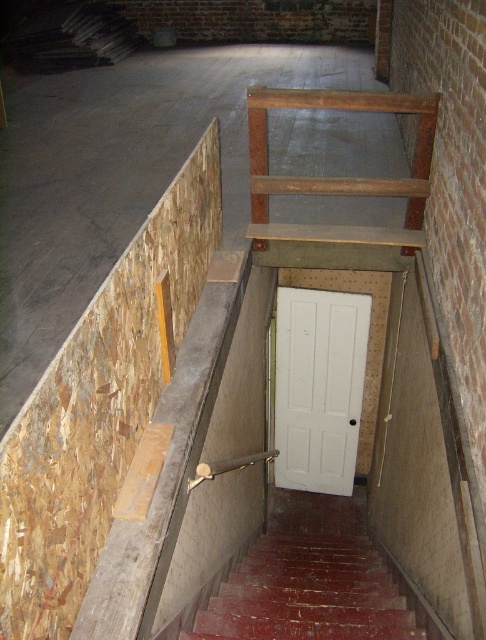
Is point (359, 589) positioned after point (250, 161)?

No, (359, 589) is in front of (250, 161).

Is rusty metal stairs at lower center behind wooden at upper center?

That is False.

Who is more forward, [275,621] or [252,180]?

Positioned in front is point [275,621].

You are a GUI agent. You are given a task and a screenshot of the screen. Output one action in this format:
    pyautogui.click(x=<x>, y=<y>)
    Task: Click on the rusty metal stairs at lower center
    Image resolution: width=486 pixels, height=640 pixels.
    Given the screenshot: What is the action you would take?
    pyautogui.click(x=308, y=593)

Does white painted wood door at center have a larger size compared to wooden at upper center?

Yes, white painted wood door at center is bigger than wooden at upper center.

Which is behind, point (367, 317) or point (302, 188)?

Positioned behind is point (367, 317).

The image size is (486, 640). I want to click on white painted wood door at center, so click(318, 387).

Does rusty metal stairs at lower center appear on the left side of white painted wood door at center?

Indeed, rusty metal stairs at lower center is positioned on the left side of white painted wood door at center.

Who is positioned more to the right, rusty metal stairs at lower center or white painted wood door at center?

white painted wood door at center

Which is behind, point (312, 548) or point (293, 413)?

Positioned behind is point (293, 413).

The height and width of the screenshot is (640, 486). What are the coordinates of `rusty metal stairs at lower center` in the screenshot? It's located at (308, 593).